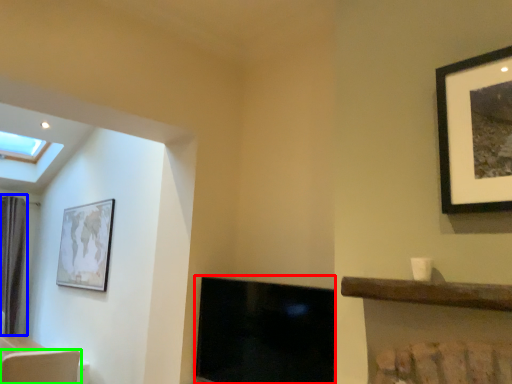
Question: Considering the real-world distances, which object is farthest from fireplace (highlighted by a red box)? curtain (highlighted by a blue box) or swivel chair (highlighted by a green box)?

Choices:
 (A) curtain
 (B) swivel chair

Answer: (A)